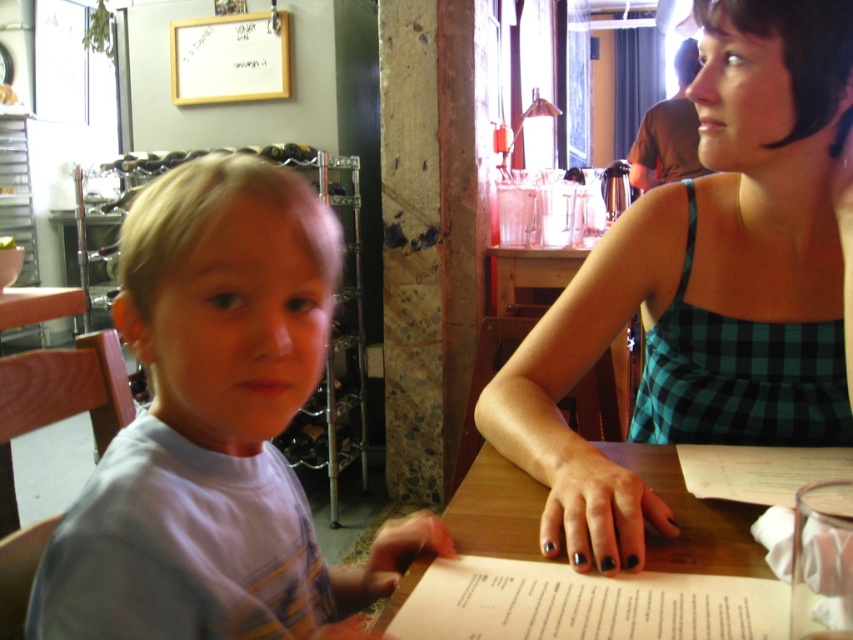
You are a customer in the restaurant and want to place a drink order. The server asks you to point to the drink you want on the menu. Which object is wider so you can easily point to it without moving your hand too far? The green checkered dress at upper right or the white paper menu at lower center?

The green checkered dress at upper right is wider than the white paper menu at lower center, so you can easily point to it without moving your hand too far.

What is the exact coordinate of the white paper menu at lower center?

The white paper menu at lower center is located at point (585, 604).